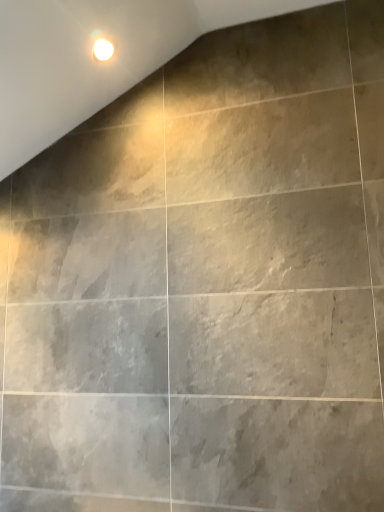
Describe the element at coordinates (103, 49) in the screenshot. The width and height of the screenshot is (384, 512). I see `white glossy light fixture at upper left` at that location.

You are a GUI agent. You are given a task and a screenshot of the screen. Output one action in this format:
    pyautogui.click(x=<x>, y=<y>)
    Task: Click on the white glossy light fixture at upper left
    The image size is (384, 512).
    Given the screenshot: What is the action you would take?
    coord(103,49)

Where is `white glossy light fixture at upper left`? white glossy light fixture at upper left is located at coordinates (103, 49).